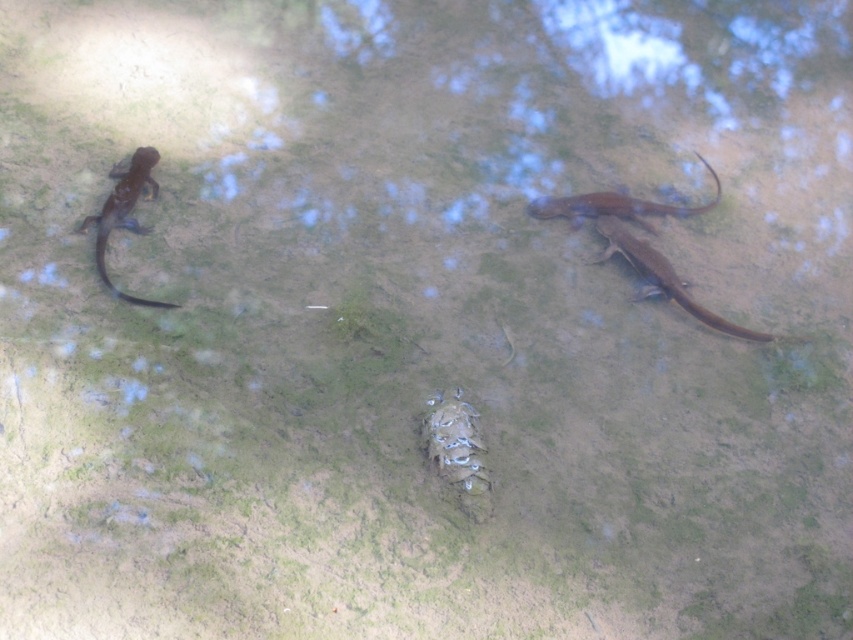
Does brown matte lizard at right have a greater height compared to shiny blue lizard at left?

In fact, brown matte lizard at right may be shorter than shiny blue lizard at left.

Can you confirm if brown matte lizard at right is wider than shiny blue lizard at left?

Yes, brown matte lizard at right is wider than shiny blue lizard at left.

Measure the distance between brown matte lizard at right and camera.

2.61 meters

This screenshot has width=853, height=640. Identify the location of brown matte lizard at right. (663, 276).

Which of these two, shiny blue lizard at left or shiny brown lizard at upper right, stands taller?

shiny blue lizard at left

Can you confirm if shiny blue lizard at left is bigger than shiny brown lizard at upper right?

Yes.

At what (x,y) coordinates should I click in order to perform the action: click on shiny blue lizard at left. Please return your answer as a coordinate pair (x, y). Looking at the image, I should click on (125, 212).

This screenshot has width=853, height=640. In order to click on shiny blue lizard at left in this screenshot , I will do point(125,212).

Between point (775, 337) and point (607, 209), which one is positioned in front?

Point (775, 337)

Locate an element on the screen. This screenshot has height=640, width=853. brown matte lizard at right is located at coordinates (663, 276).